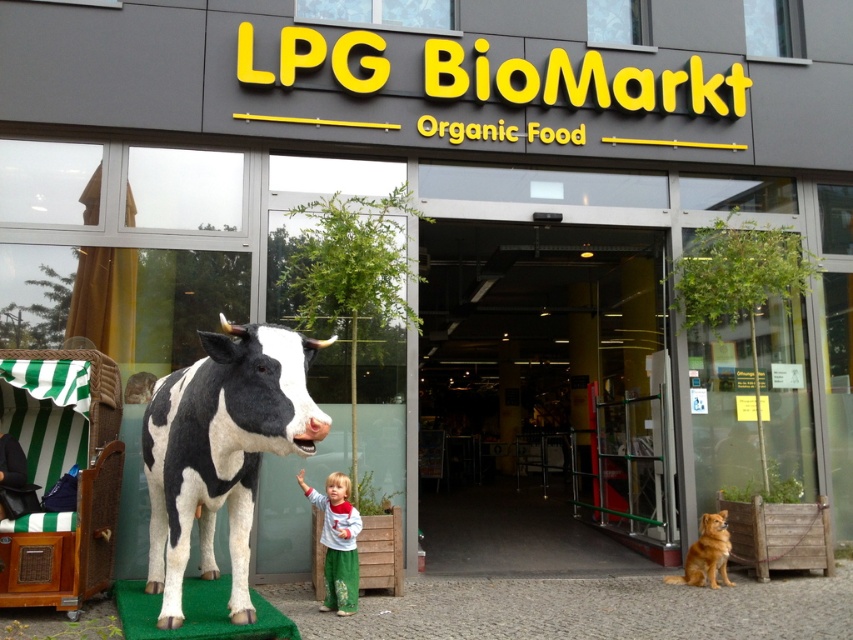
Question: Can you confirm if black and white polka dot bull at center is bigger than matte gray pants at lower center?

Choices:
 (A) yes
 (B) no

Answer: (A)

Question: Which point appears closest to the camera in this image?

Choices:
 (A) (335, 497)
 (B) (646, 544)
 (C) (213, 480)

Answer: (C)

Question: Estimate the real-world distances between objects in this image. Which object is closer to the glass door at center?

Choices:
 (A) matte gray pants at lower center
 (B) black and white polka dot bull at center

Answer: (A)

Question: Can you confirm if glass door at center is positioned to the right of black and white polka dot bull at center?

Choices:
 (A) no
 (B) yes

Answer: (B)

Question: Does glass door at center lie behind matte gray pants at lower center?

Choices:
 (A) no
 (B) yes

Answer: (B)

Question: Which point is closer to the camera taking this photo?

Choices:
 (A) (639, 262)
 (B) (338, 536)

Answer: (B)